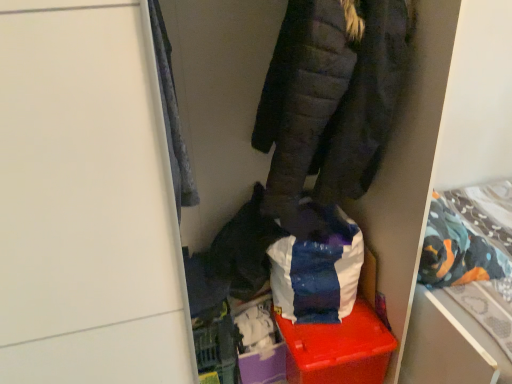
At what (x,y) coordinates should I click in order to perform the action: click on matte plastic storage box at center. Please return your answer as a coordinate pair (x, y). Looking at the image, I should click on click(x=338, y=349).

What do you see at coordinates (331, 97) in the screenshot? The image size is (512, 384). I see `dark gray quilted jacket at upper center` at bounding box center [331, 97].

Identify the location of velvety gray blanket at upper left. (170, 114).

Is velvety gray blanket at upper left facing away from matte plastic storage box at center?

No.

Considering the positions of objects velvety gray blanket at upper left and matte plastic storage box at center in the image provided, who is more to the left, velvety gray blanket at upper left or matte plastic storage box at center?

velvety gray blanket at upper left.

Does velvety gray blanket at upper left have a lesser width compared to matte plastic storage box at center?

Yes.

Between velvety gray blanket at upper left and matte plastic storage box at center, which one has smaller size?

velvety gray blanket at upper left.

Which is more to the left, matte plastic storage box at center or velvety gray blanket at upper left?

Positioned to the left is velvety gray blanket at upper left.

Is matte plastic storage box at center not near velvety gray blanket at upper left?

matte plastic storage box at center is near velvety gray blanket at upper left, not far away.

From the image's perspective, which object appears higher, matte plastic storage box at center or velvety gray blanket at upper left?

velvety gray blanket at upper left.

Considering the points (355, 379) and (181, 175), which point is in front, point (355, 379) or point (181, 175)?

The point (181, 175) is closer to the camera.

Is velvety gray blanket at upper left spatially inside dark gray quilted jacket at upper center, or outside of it?

velvety gray blanket at upper left is outside dark gray quilted jacket at upper center.

What's the angular difference between velvety gray blanket at upper left and dark gray quilted jacket at upper center's facing directions?

The angle between the facing direction of velvety gray blanket at upper left and the facing direction of dark gray quilted jacket at upper center is 0.00227 degrees.

From the image's perspective, is velvety gray blanket at upper left positioned above or below dark gray quilted jacket at upper center?

velvety gray blanket at upper left is below dark gray quilted jacket at upper center.

Between velvety gray blanket at upper left and dark gray quilted jacket at upper center, which one has smaller width?

velvety gray blanket at upper left is thinner.

Considering the sizes of matte plastic storage box at center and dark gray quilted jacket at upper center in the image, is matte plastic storage box at center bigger or smaller than dark gray quilted jacket at upper center?

In the image, matte plastic storage box at center appears to be smaller than dark gray quilted jacket at upper center.

Which of these two, matte plastic storage box at center or dark gray quilted jacket at upper center, stands shorter?

Standing shorter between the two is matte plastic storage box at center.

Which object is closer to the camera taking this photo, matte plastic storage box at center or dark gray quilted jacket at upper center?

dark gray quilted jacket at upper center is closer to the camera.

Considering the relative sizes of matte plastic storage box at center and dark gray quilted jacket at upper center in the image provided, is matte plastic storage box at center thinner than dark gray quilted jacket at upper center?

Incorrect, the width of matte plastic storage box at center is not less than that of dark gray quilted jacket at upper center.

From the image's perspective, who appears lower, dark gray quilted jacket at upper center or velvety gray blanket at upper left?

velvety gray blanket at upper left appears lower in the image.

In terms of width, does dark gray quilted jacket at upper center look wider or thinner when compared to velvety gray blanket at upper left?

dark gray quilted jacket at upper center is wider than velvety gray blanket at upper left.

From the picture: Is the depth of dark gray quilted jacket at upper center greater than that of velvety gray blanket at upper left?

Yes, it is.

From their relative heights in the image, would you say dark gray quilted jacket at upper center is taller or shorter than velvety gray blanket at upper left?

In the image, dark gray quilted jacket at upper center appears to be shorter than velvety gray blanket at upper left.

From a real-world perspective, which object rests below the other?

patterned fabric bed at right is physically lower.

How different are the orientations of patterned fabric bed at right and dark gray quilted jacket at upper center in degrees?

patterned fabric bed at right and dark gray quilted jacket at upper center are facing 89.2 degrees away from each other.

Which is correct: patterned fabric bed at right is inside dark gray quilted jacket at upper center, or outside of it?

patterned fabric bed at right exists outside the volume of dark gray quilted jacket at upper center.

Can you confirm if patterned fabric bed at right is shorter than dark gray quilted jacket at upper center?

Indeed, patterned fabric bed at right has a lesser height compared to dark gray quilted jacket at upper center.

From a real-world perspective, is matte plastic storage box at center positioned above or below patterned fabric bed at right?

Clearly, from a real-world perspective, matte plastic storage box at center is below patterned fabric bed at right.

Based on the photo, is matte plastic storage box at center positioned with its back to patterned fabric bed at right?

No, matte plastic storage box at center is not facing the opposite direction of patterned fabric bed at right.

Considering the relative positions of matte plastic storage box at center and patterned fabric bed at right in the image provided, is matte plastic storage box at center to the left or to the right of patterned fabric bed at right?

Clearly, matte plastic storage box at center is on the left of patterned fabric bed at right in the image.

What are the coordinates of `bed on the right of matte plastic storage box at center` in the screenshot? It's located at (465, 296).

Image resolution: width=512 pixels, height=384 pixels. I want to click on storage box below the velvety gray blanket at upper left (from a real-world perspective), so click(x=338, y=349).

Locate an element on the screen. This screenshot has width=512, height=384. storage box below the velvety gray blanket at upper left (from the image's perspective) is located at coordinates (338, 349).

When comparing their distances from dark gray quilted jacket at upper center, does patterned fabric bed at right or matte plastic storage box at center seem closer?

patterned fabric bed at right is positioned closer to the anchor dark gray quilted jacket at upper center.

Based on their spatial positions, is matte plastic storage box at center or dark gray quilted jacket at upper center further from patterned fabric bed at right?

Based on the image, dark gray quilted jacket at upper center appears to be further to patterned fabric bed at right.

When comparing their distances from patterned fabric bed at right, does velvety gray blanket at upper left or matte plastic storage box at center seem closer?

The object closer to patterned fabric bed at right is matte plastic storage box at center.

Which object lies further to the anchor point matte plastic storage box at center, velvety gray blanket at upper left or patterned fabric bed at right?

velvety gray blanket at upper left.

Estimate the real-world distances between objects in this image. Which object is further from dark gray quilted jacket at upper center, patterned fabric bed at right or velvety gray blanket at upper left?

patterned fabric bed at right.

Based on their spatial positions, is dark gray quilted jacket at upper center or patterned fabric bed at right closer to velvety gray blanket at upper left?

dark gray quilted jacket at upper center lies closer to velvety gray blanket at upper left than the other object.

Based on their spatial positions, is matte plastic storage box at center or dark gray quilted jacket at upper center further from velvety gray blanket at upper left?

matte plastic storage box at center is further to velvety gray blanket at upper left.

Based on their spatial positions, is velvety gray blanket at upper left or patterned fabric bed at right further from dark gray quilted jacket at upper center?

Based on the image, patterned fabric bed at right appears to be further to dark gray quilted jacket at upper center.

This screenshot has width=512, height=384. I want to click on jacket located between velvety gray blanket at upper left and patterned fabric bed at right in the left-right direction, so click(331, 97).

Image resolution: width=512 pixels, height=384 pixels. What are the coordinates of `bed between dark gray quilted jacket at upper center and matte plastic storage box at center from top to bottom` in the screenshot? It's located at (465, 296).

Find the location of a particular element. storage box between velvety gray blanket at upper left and patterned fabric bed at right is located at coordinates (338, 349).

Where is `cloak between dark gray quilted jacket at upper center and matte plastic storage box at center vertically`? cloak between dark gray quilted jacket at upper center and matte plastic storage box at center vertically is located at coordinates (170, 114).